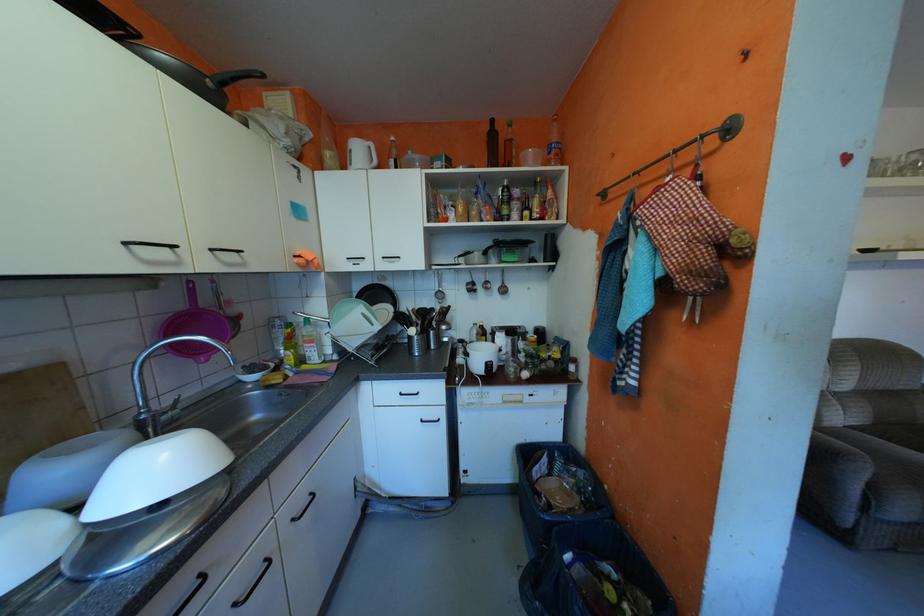
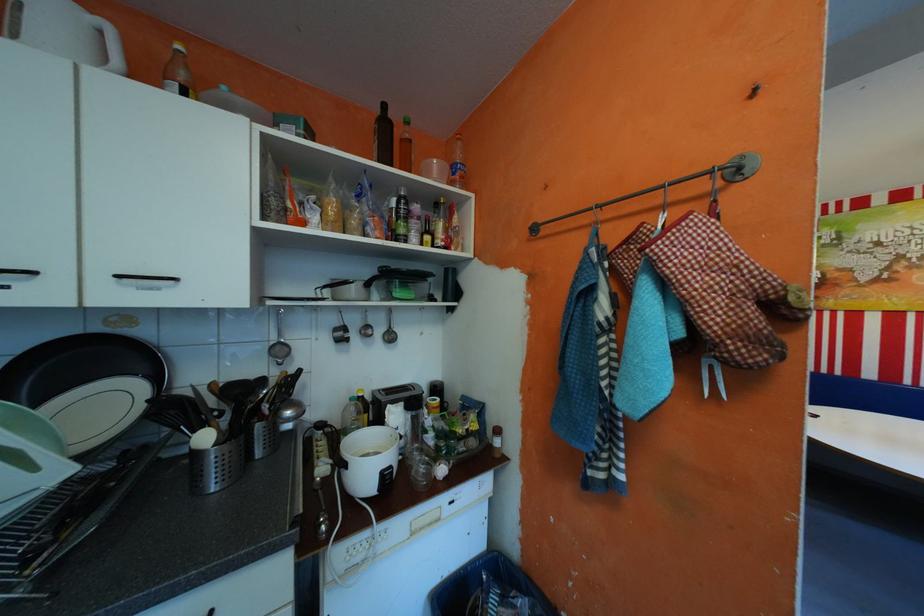
Locate, in the second image, the point that corresponds to (x=477, y=342) in the first image.

(339, 429)